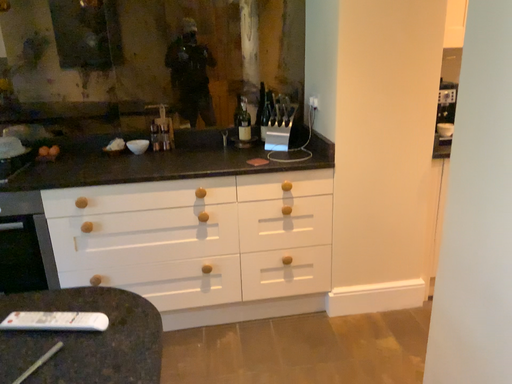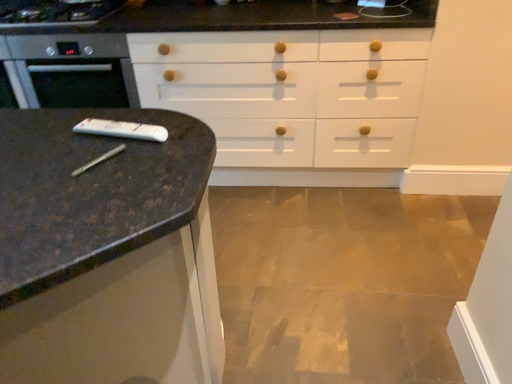
Question: How did the camera likely rotate when shooting the video?

Choices:
 (A) rotated downward
 (B) rotated upward

Answer: (A)